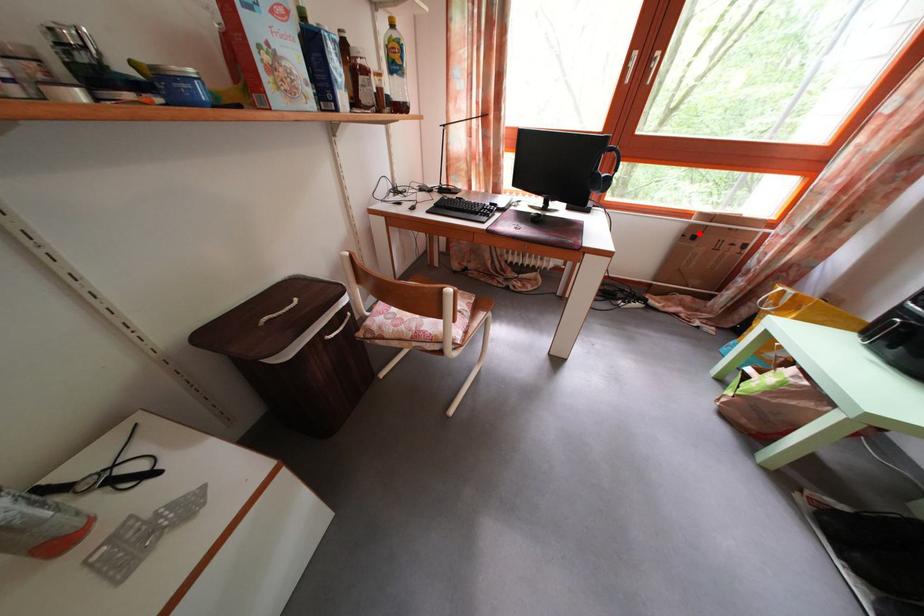
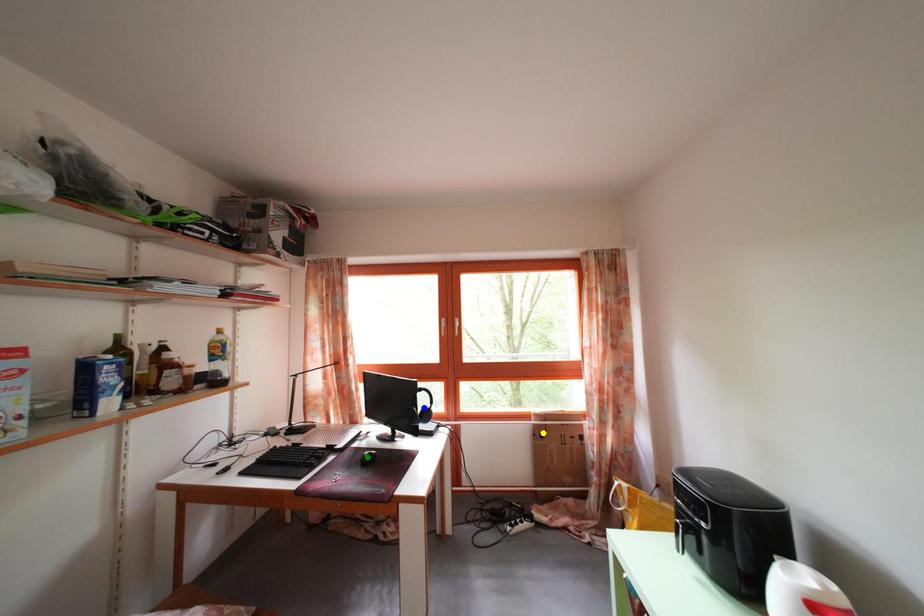
Question: I am providing you with two images of the same scene from different viewpoints. A red point is marked on the first image. You are given multiple points on the second image. Which spot in image 2 lines up with the point in image 1?

Choices:
 (A) yellow point
 (B) blue point
 (C) green point

Answer: (A)